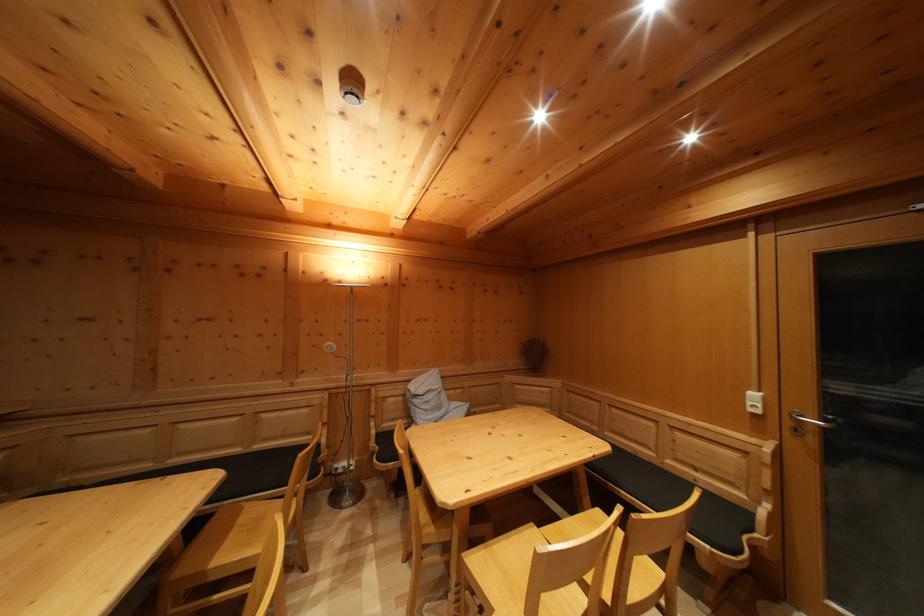
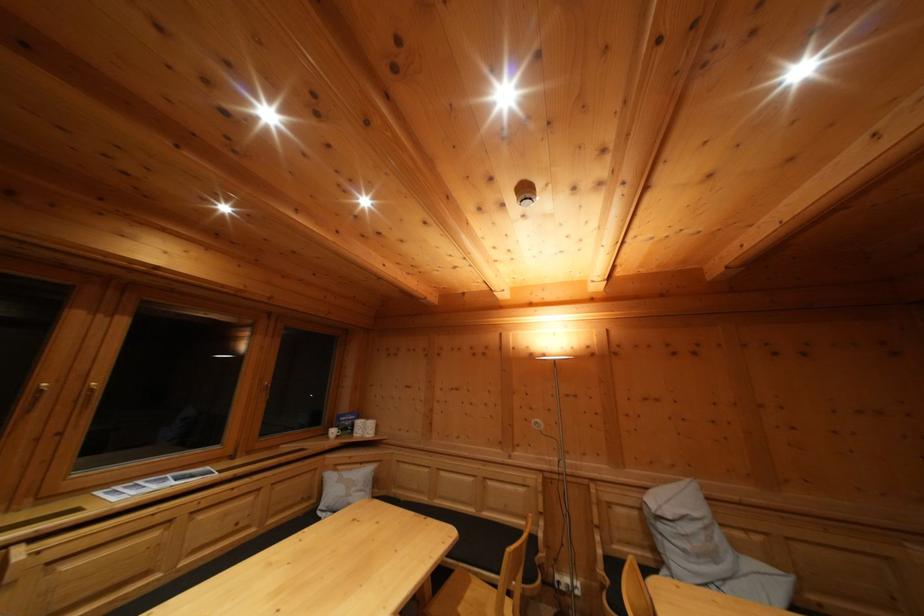
In the second image, find the point that corresponds to [314,440] in the first image.

(532, 525)